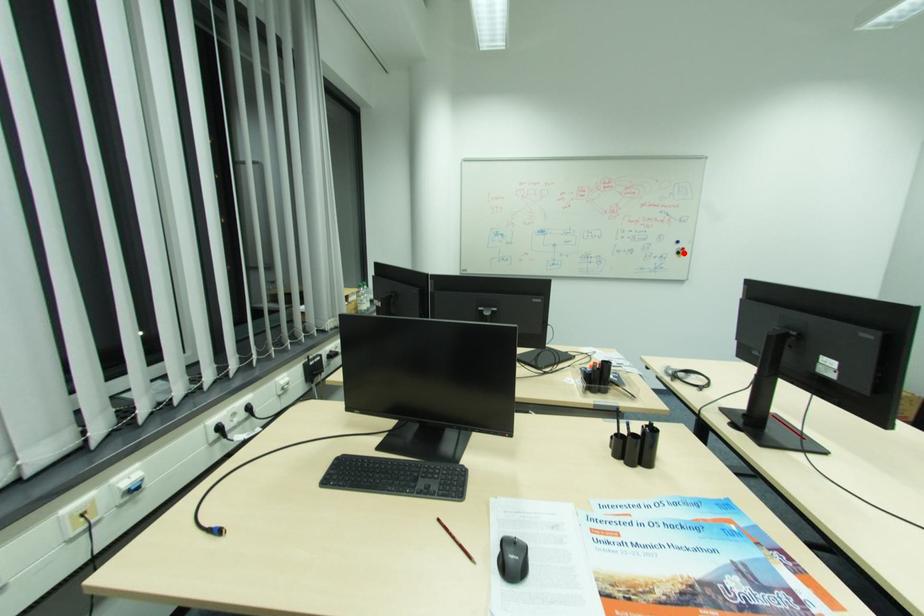
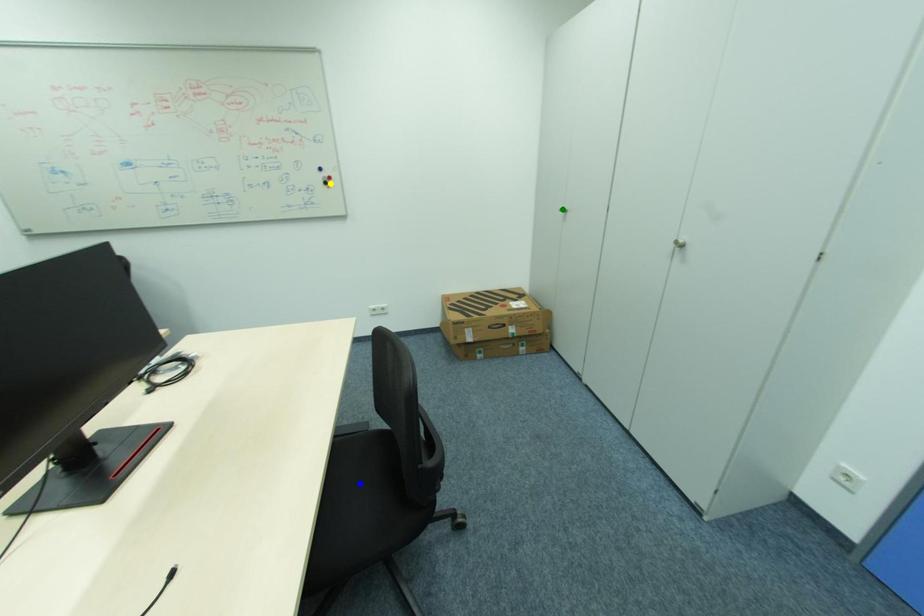
Question: I am providing you with two images of the same scene from different viewpoints. A red point is marked on the first image. You are given multiple points on the second image. Which mark in image 2 goes with the point in image 1?

Choices:
 (A) yellow point
 (B) blue point
 (C) green point

Answer: (A)